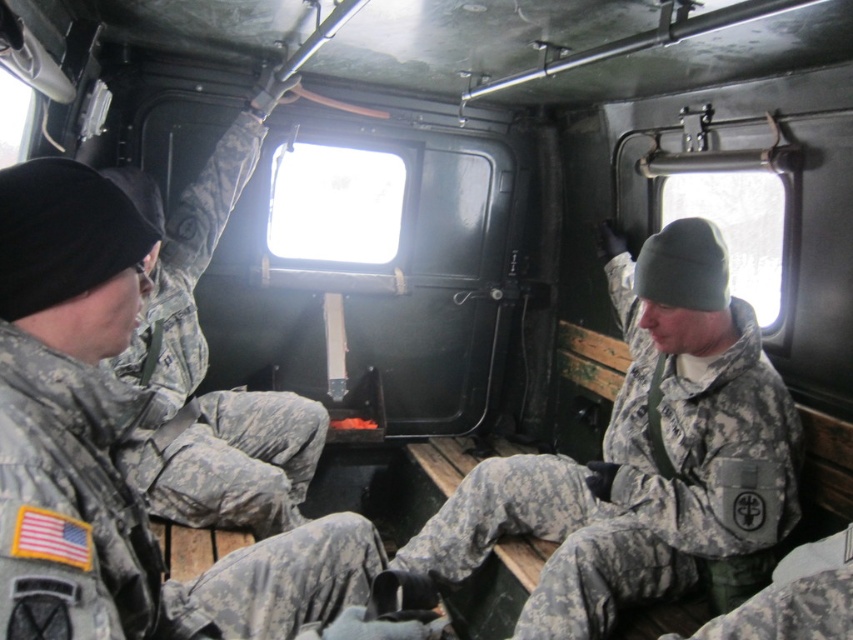
Does camouflage fabric uniform at center appear under camouflage uniform at left?

Actually, camouflage fabric uniform at center is above camouflage uniform at left.

Is camouflage fabric uniform at center thinner than camouflage uniform at left?

No, camouflage fabric uniform at center is not thinner than camouflage uniform at left.

Locate an element on the screen. The width and height of the screenshot is (853, 640). camouflage fabric uniform at center is located at coordinates (645, 458).

This screenshot has width=853, height=640. I want to click on camouflage fabric uniform at center, so click(x=645, y=458).

Is point (3, 465) more distant than point (167, 445)?

No, (3, 465) is in front of (167, 445).

This screenshot has width=853, height=640. What do you see at coordinates (108, 432) in the screenshot?
I see `camouflage uniform at left` at bounding box center [108, 432].

I want to click on camouflage uniform at left, so click(108, 432).

Between camouflage fabric uniform at center and camouflage fabric uniform at left, which one has more height?

With more height is camouflage fabric uniform at left.

Who is lower down, camouflage fabric uniform at center or camouflage fabric uniform at left?

Positioned lower is camouflage fabric uniform at center.

Is point (636, 435) less distant than point (177, 440)?

Yes.

The image size is (853, 640). Find the location of `camouflage fabric uniform at center`. camouflage fabric uniform at center is located at coordinates (645, 458).